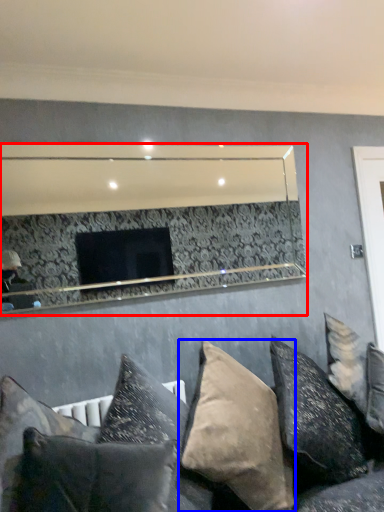
Question: Among these objects, which one is farthest to the camera, mirror (highlighted by a red box) or pillow (highlighted by a blue box)?

Choices:
 (A) mirror
 (B) pillow

Answer: (A)